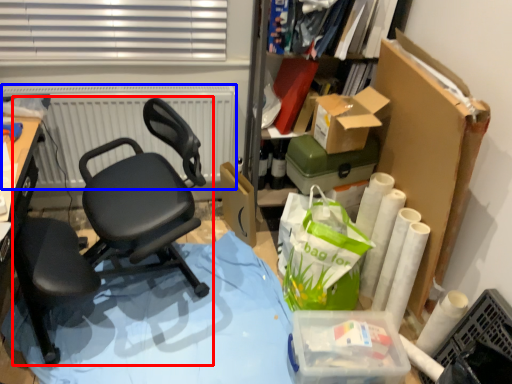
Question: Which of the following is the farthest to the observer, chair (highlighted by a red box) or radiator (highlighted by a blue box)?

Choices:
 (A) chair
 (B) radiator

Answer: (B)